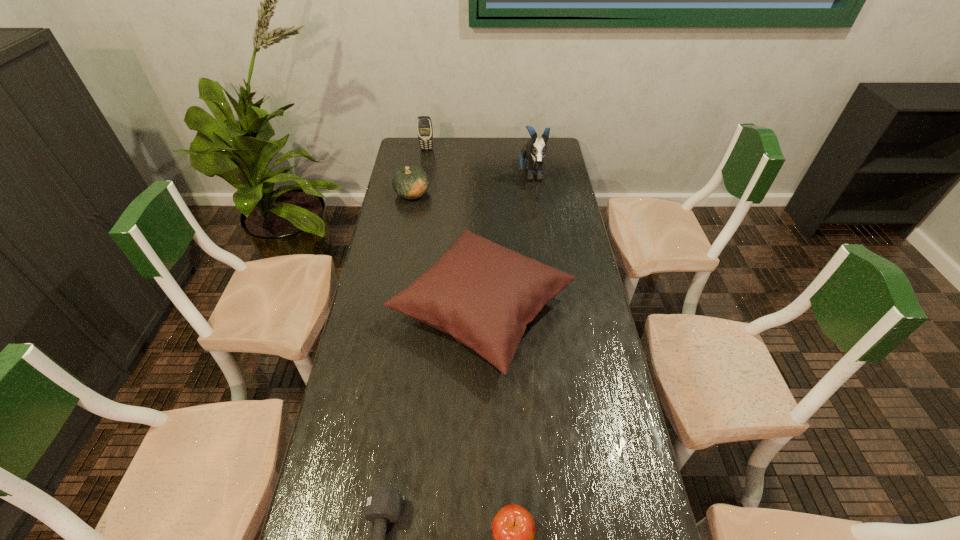
Locate an element on the screen. cushion that is positioned at the left edge is located at coordinates (483, 294).

I want to click on cellular telephone at the left edge, so (x=424, y=125).

In order to click on gourd situated at the left edge in this screenshot , I will do `click(412, 182)`.

Where is `puppy positioned at the right edge`? This screenshot has width=960, height=540. puppy positioned at the right edge is located at coordinates (535, 149).

Where is `cushion present at the right edge`? Image resolution: width=960 pixels, height=540 pixels. cushion present at the right edge is located at coordinates (483, 294).

At what (x,y) coordinates should I click in order to perform the action: click on object situated at the far left corner. Please return your answer as a coordinate pair (x, y). Looking at the image, I should click on (424, 125).

Where is `object that is at the far right corner`? This screenshot has width=960, height=540. object that is at the far right corner is located at coordinates (535, 149).

The width and height of the screenshot is (960, 540). In order to click on vacant space at the far edge in this screenshot , I will do click(456, 162).

The width and height of the screenshot is (960, 540). Find the location of `vacant space at the left edge of the desktop`. vacant space at the left edge of the desktop is located at coordinates (348, 404).

Identify the location of free spot at the right edge of the desktop. (561, 172).